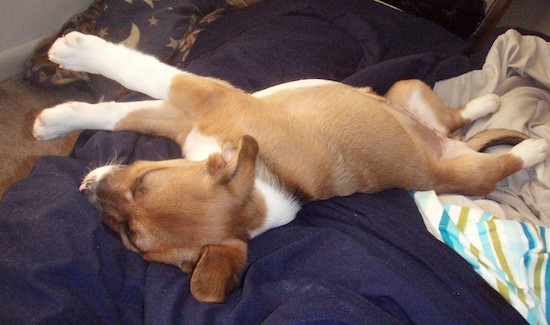
Locate an element on the screen. wall is located at coordinates (18, 16).